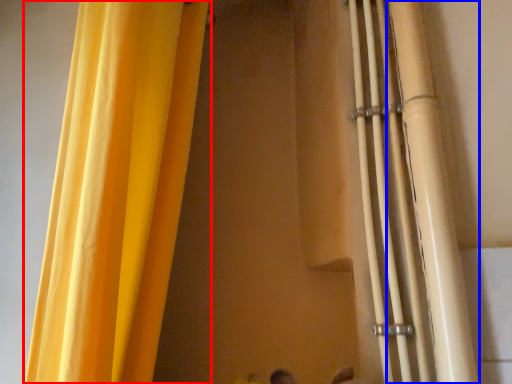
Question: Which of the following is the closest to the observer, curtain (highlighted by a red box) or pipe (highlighted by a blue box)?

Choices:
 (A) curtain
 (B) pipe

Answer: (A)